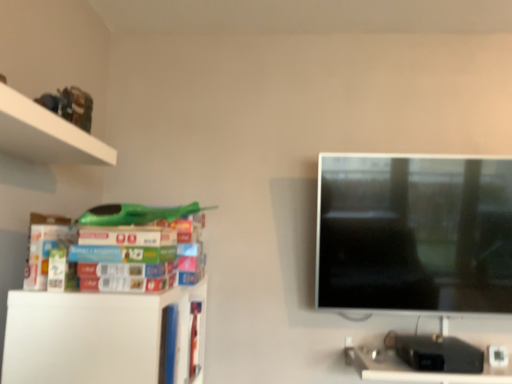
Find the location of `black plastic computer desk at lower right`. black plastic computer desk at lower right is located at coordinates (429, 371).

Identify the location of black plastic computer desk at lower right. This screenshot has height=384, width=512. (429, 371).

Is white matte shelf at lower left positioned beyond the bounds of black plastic computer desk at lower right?

white matte shelf at lower left lies outside black plastic computer desk at lower right's area.

Is white matte shelf at lower left turned away from black plastic computer desk at lower right?

No, white matte shelf at lower left is not facing the opposite direction of black plastic computer desk at lower right.

From a real-world perspective, is white matte shelf at lower left physically below black plastic computer desk at lower right?

No.

Considering the positions of objects white matte shelf at lower left and black plastic computer desk at lower right in the image provided, who is more to the left, white matte shelf at lower left or black plastic computer desk at lower right?

From the viewer's perspective, white matte shelf at lower left appears more on the left side.

From the image's perspective, would you say black plastic computer desk at lower right is shown under white matte shelf at lower left?

Yes, from the image's perspective, black plastic computer desk at lower right is below white matte shelf at lower left.

Where is `computer desk that is behind the white matte shelf at lower left`? The height and width of the screenshot is (384, 512). computer desk that is behind the white matte shelf at lower left is located at coordinates (429, 371).

Considering the relative positions of black plastic computer desk at lower right and white matte shelf at lower left in the image provided, is black plastic computer desk at lower right to the left or to the right of white matte shelf at lower left?

black plastic computer desk at lower right is positioned on white matte shelf at lower left's right side.

Relative to white matte shelf at lower left, is black plastic computer desk at lower right in front or behind?

Clearly, black plastic computer desk at lower right is behind white matte shelf at lower left.

Who is smaller, white matte shelf at lower left or matte plastic books at left?

matte plastic books at left is smaller.

Between white matte shelf at lower left and matte plastic books at left, which one is positioned in front?

Positioned in front is matte plastic books at left.

This screenshot has height=384, width=512. There is a white matte shelf at lower left. What are the coordinates of `book above it (from a real-world perspective)` in the screenshot? It's located at (117, 248).

Is white matte shelf at lower left facing towards matte plastic books at left?

No, white matte shelf at lower left is not turned towards matte plastic books at left.

From the image's perspective, is matte plastic books at left located beneath black plastic computer desk at lower right?

No, from the image's perspective, matte plastic books at left is not below black plastic computer desk at lower right.

Is black plastic computer desk at lower right surrounded by matte plastic books at left?

No, black plastic computer desk at lower right is not inside matte plastic books at left.

Which is more to the right, matte plastic books at left or black plastic computer desk at lower right?

black plastic computer desk at lower right is more to the right.

Does point (106, 259) appear closer or farther from the camera than point (497, 341)?

Point (106, 259) appears to be closer to the viewer than point (497, 341).

Do you think matte plastic books at left is within white matte shelf at lower left, or outside of it?

matte plastic books at left lies outside white matte shelf at lower left.

From a real-world perspective, between matte plastic books at left and white matte shelf at lower left, who is vertically higher?

matte plastic books at left is physically above.

From the picture: Considering the relative positions of matte plastic books at left and white matte shelf at lower left in the image provided, is matte plastic books at left to the left of white matte shelf at lower left from the viewer's perspective?

In fact, matte plastic books at left is to the right of white matte shelf at lower left.

Is point (387, 358) positioned behind point (28, 279)?

That is True.

Does black plastic computer desk at lower right turn towards matte plastic books at left?

No, black plastic computer desk at lower right is not facing towards matte plastic books at left.

In the scene shown: Visually, is black plastic computer desk at lower right positioned to the left or to the right of matte plastic books at left?

Based on their positions, black plastic computer desk at lower right is located to the right of matte plastic books at left.

Locate an element on the screen. computer desk beneath the white matte shelf at lower left (from a real-world perspective) is located at coordinates (429, 371).

You are a GUI agent. You are given a task and a screenshot of the screen. Output one action in this format:
    pyautogui.click(x=<x>, y=<y>)
    Task: Click on the shelf in front of the black plastic computer desk at lower right
    
    Given the screenshot: What is the action you would take?
    pyautogui.click(x=103, y=336)

When comparing their distances from black plastic computer desk at lower right, does white matte shelf at lower left or matte plastic books at left seem closer?

white matte shelf at lower left is closer to black plastic computer desk at lower right.

Based on their spatial positions, is matte plastic books at left or white matte shelf at lower left closer to black plastic computer desk at lower right?

white matte shelf at lower left lies closer to black plastic computer desk at lower right than the other object.

Looking at the image, which one is located further to white matte shelf at lower left, matte plastic books at left or black plastic computer desk at lower right?

black plastic computer desk at lower right is positioned further to the anchor white matte shelf at lower left.

Estimate the real-world distances between objects in this image. Which object is closer to matte plastic books at left, white matte shelf at lower left or black plastic computer desk at lower right?

Based on the image, white matte shelf at lower left appears to be nearer to matte plastic books at left.

Estimate the real-world distances between objects in this image. Which object is further from matte plastic books at left, black plastic computer desk at lower right or white matte shelf at lower left?

Among the two, black plastic computer desk at lower right is located further to matte plastic books at left.

In the scene shown: Based on their spatial positions, is black plastic computer desk at lower right or matte plastic books at left further from white matte shelf at lower left?

black plastic computer desk at lower right is positioned further to the anchor white matte shelf at lower left.

This screenshot has width=512, height=384. What are the coordinates of `book between white matte shelf at lower left and black plastic computer desk at lower right in the horizontal direction` in the screenshot? It's located at (117, 248).